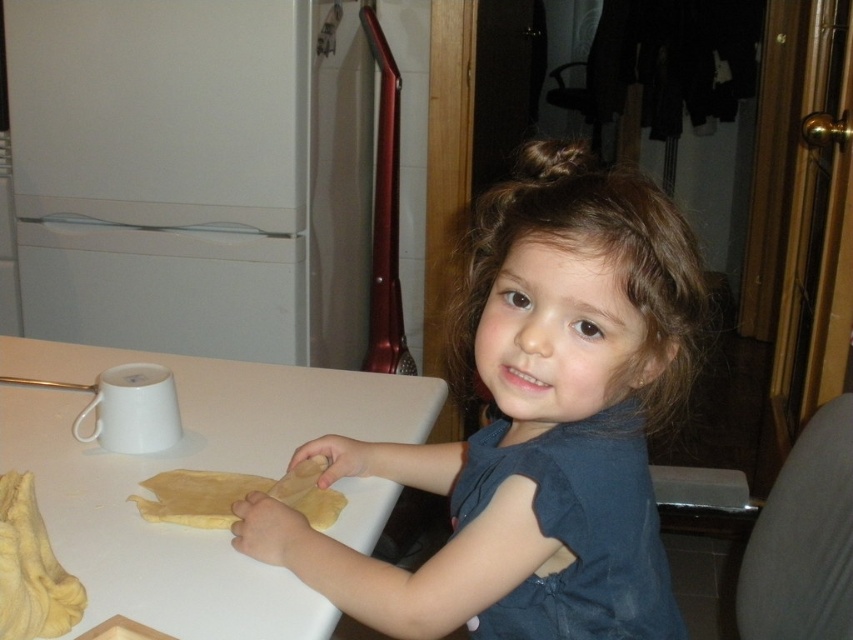
Question: Does smooth brown hair at center appear on the left side of yellow dough at center?

Choices:
 (A) no
 (B) yes

Answer: (A)

Question: Which is nearer to the yellow dough at center?

Choices:
 (A) white matte table at center
 (B) smooth brown hair at center

Answer: (A)

Question: Considering the relative positions of white matte table at center and yellow dough at center in the image provided, where is white matte table at center located with respect to yellow dough at center?

Choices:
 (A) right
 (B) left

Answer: (B)

Question: Observing the image, what is the correct spatial positioning of smooth brown hair at center in reference to white matte table at center?

Choices:
 (A) right
 (B) left

Answer: (A)

Question: Which point appears farthest from the camera in this image?

Choices:
 (A) (206, 368)
 (B) (532, 355)

Answer: (A)

Question: Which of these objects is positioned farthest from the smooth brown hair at center?

Choices:
 (A) white matte table at center
 (B) yellow dough at center

Answer: (A)